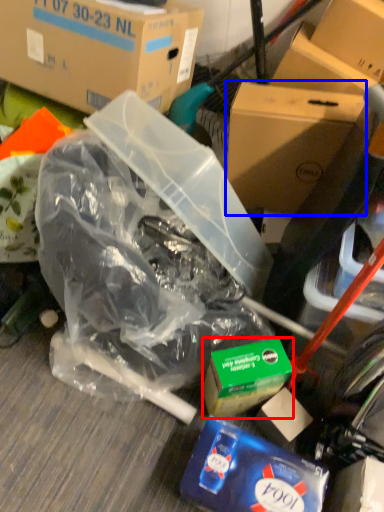
Question: Which object appears closest to the camera in this image, product (highlighted by a red box) or box (highlighted by a blue box)?

Choices:
 (A) product
 (B) box

Answer: (A)